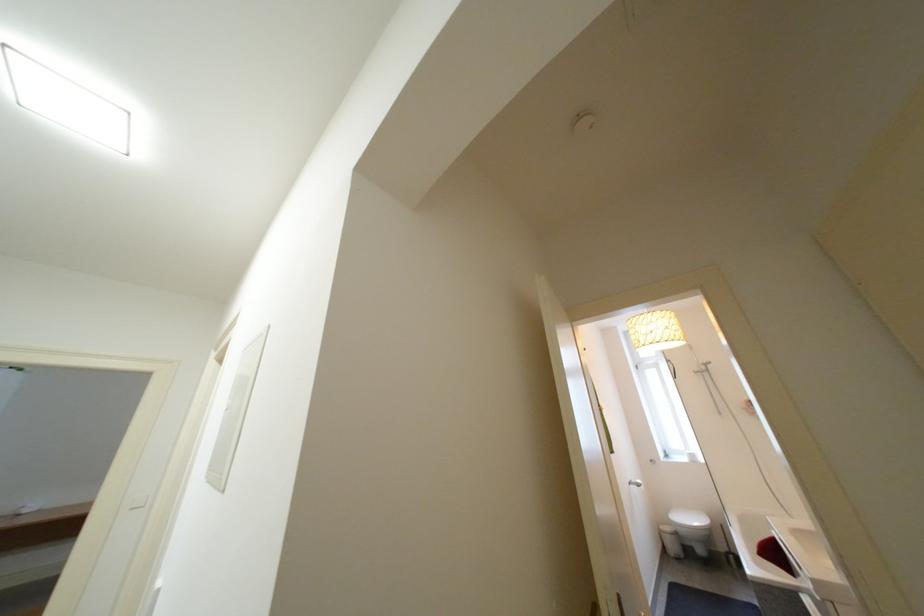
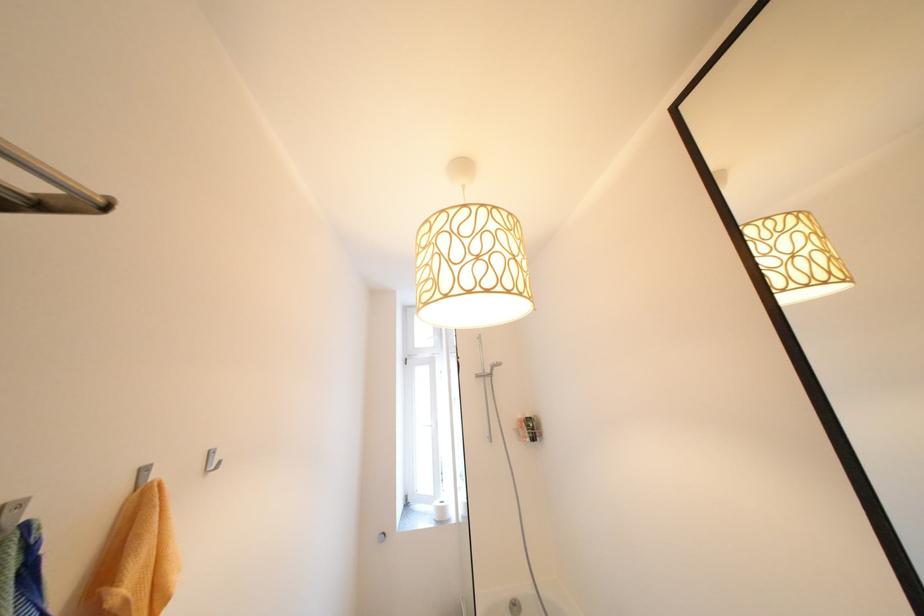
Locate, in the second image, the point that corresponds to point 706,370 in the first image.

(490, 371)